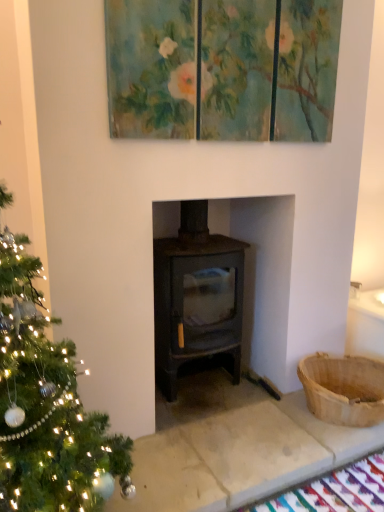
Question: Considering their positions, is brown woven basket at right located in front of or behind matte black stove at center?

Choices:
 (A) behind
 (B) front

Answer: (A)

Question: From a real-world perspective, is brown woven basket at right physically located above or below matte black stove at center?

Choices:
 (A) above
 (B) below

Answer: (B)

Question: Based on their relative distances, which object is farther from the matte black stove at center?

Choices:
 (A) teal textured triptych at upper center
 (B) brown woven basket at right

Answer: (A)

Question: Which is nearer to the matte black stove at center?

Choices:
 (A) teal textured triptych at upper center
 (B) brown woven basket at right

Answer: (B)